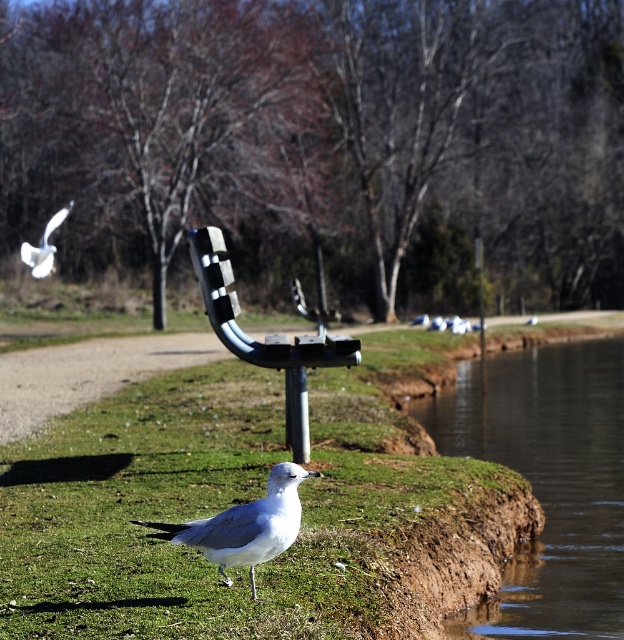
You are standing in the outdoor scene and want to walk from point A to point B. Point A is at coordinates point [490,388] and point B is at coordinates point [39,266]. Since you can only move forward, which point will you reach first?

You will reach point [39,266] first because it is closer to you than point [490,388], which is further away.

You are standing in the scene and want to walk from the brown dirt at lower right to the white feathered bird at upper left. Which direction should you move to get closer to the bird?

You should move away from the brown dirt at lower right towards the white feathered bird at upper left since the dirt is closer to you than the bird, meaning the bird is further away in the scene.

You are a photographer trying to capture the white matte bird at lower center while avoiding the green grass at lower center. Based on their positions, which direction should you move your camera to frame the bird without the grass in the shot?

The green grass at lower center is to the left of the white matte bird at lower center. To avoid the grass, move your camera to the right so that the white matte bird at lower center is framed without the green grass at lower center in the shot.